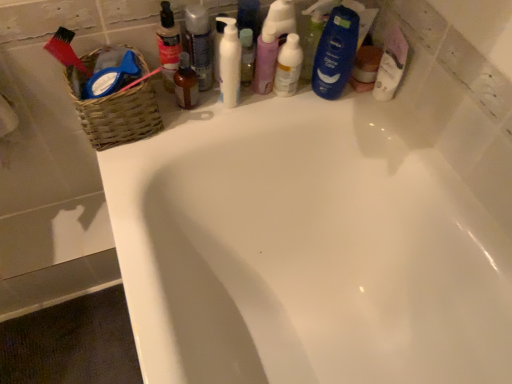
At what (x,y) coordinates should I click in order to perform the action: click on woven brown basket at upper left. Please return your answer as a coordinate pair (x, y). Looking at the image, I should click on (116, 113).

The height and width of the screenshot is (384, 512). Describe the element at coordinates (266, 59) in the screenshot. I see `purple matte lotion at center, which is the 4th toiletry in left-to-right order` at that location.

The image size is (512, 384). Identify the location of white glossy bottle at upper center. (288, 67).

This screenshot has width=512, height=384. What do you see at coordinates (335, 53) in the screenshot? I see `blue glossy shampoo bottle at upper right, the 1th toiletry viewed from the right` at bounding box center [335, 53].

The height and width of the screenshot is (384, 512). What are the coordinates of `translucent plastic bottle at upper center, which is the 1th toiletry in left-to-right order` in the screenshot? It's located at (168, 45).

This screenshot has width=512, height=384. I want to click on white glossy bathtub at upper center, so click(306, 249).

You are a GUI agent. You are given a task and a screenshot of the screen. Output one action in this format:
    pyautogui.click(x=<x>, y=<y>)
    Task: Click on the woven brown basket at upper left
    The height and width of the screenshot is (384, 512).
    Given the screenshot: What is the action you would take?
    pyautogui.click(x=116, y=113)

Does point (88, 116) appear closer or farther from the camera than point (199, 28)?

Point (88, 116) is positioned closer to the camera compared to point (199, 28).

Does woven brown basket at upper left contain translucent plastic bottle at upper center, positioned as the 3th toiletry in right-to-left order?

Definitely not — translucent plastic bottle at upper center, positioned as the 3th toiletry in right-to-left order, is not inside woven brown basket at upper left.

Could you tell me if woven brown basket at upper left is turned towards translucent plastic bottle at upper center, positioned as the 3th toiletry in right-to-left order?

No, woven brown basket at upper left is not facing towards translucent plastic bottle at upper center, positioned as the 3th toiletry in right-to-left order.

Is woven brown basket at upper left closer to camera compared to translucent plastic bottle at upper center, positioned as the 3th toiletry in left-to-right order?

Yes.

Is white matte pump bottle at upper center looking in the opposite direction of white glossy bathtub at upper center?

That's not correct — white matte pump bottle at upper center is not looking away from white glossy bathtub at upper center.

Is white matte pump bottle at upper center closer to the viewer compared to white glossy bathtub at upper center?

No.

From the image's perspective, which is above, white matte pump bottle at upper center or white glossy bathtub at upper center?

From the image's view, white matte pump bottle at upper center is above.

The width and height of the screenshot is (512, 384). I want to click on bathtub on the right of white matte pump bottle at upper center, so click(x=306, y=249).

From the picture: Is blue glossy shampoo bottle at upper right, which ranks as the fifth toiletry in left-to-right order, facing towards translucent plastic bottle at upper center, the 5th toiletry in the right-to-left sequence?

No, blue glossy shampoo bottle at upper right, which ranks as the fifth toiletry in left-to-right order, is not facing towards translucent plastic bottle at upper center, the 5th toiletry in the right-to-left sequence.

From the image's perspective, is blue glossy shampoo bottle at upper right, the 1th toiletry viewed from the right, on top of translucent plastic bottle at upper center, the 5th toiletry in the right-to-left sequence?

Correct, blue glossy shampoo bottle at upper right, the 1th toiletry viewed from the right, appears higher than translucent plastic bottle at upper center, the 5th toiletry in the right-to-left sequence, in the image.

Based on their positions, is blue glossy shampoo bottle at upper right, which ranks as the fifth toiletry in left-to-right order, located to the left or right of translucent plastic bottle at upper center, the 5th toiletry in the right-to-left sequence?

blue glossy shampoo bottle at upper right, which ranks as the fifth toiletry in left-to-right order, is to the right of translucent plastic bottle at upper center, the 5th toiletry in the right-to-left sequence.

Can you tell me how much blue glossy shampoo bottle at upper right, which ranks as the fifth toiletry in left-to-right order, and translucent plastic bottle at upper center, which is the 1th toiletry in left-to-right order, differ in facing direction?

60.2 degrees.

In terms of height, does white matte pump bottle at upper center look taller or shorter compared to translucent plastic bottle at upper center, positioned as the 3th toiletry in left-to-right order?

Considering their sizes, white matte pump bottle at upper center has more height than translucent plastic bottle at upper center, positioned as the 3th toiletry in left-to-right order.

From the picture: Between white matte pump bottle at upper center and translucent plastic bottle at upper center, positioned as the 3th toiletry in right-to-left order, which one is positioned behind?

translucent plastic bottle at upper center, positioned as the 3th toiletry in right-to-left order, is behind.

From the image's perspective, would you say white matte pump bottle at upper center is positioned over translucent plastic bottle at upper center, positioned as the 3th toiletry in right-to-left order?

No, from the image's perspective, white matte pump bottle at upper center is not over translucent plastic bottle at upper center, positioned as the 3th toiletry in right-to-left order.

Is point (222, 57) more distant than point (206, 90)?

No, (222, 57) is closer to viewer.

Is point (204, 72) closer or farther from the camera than point (178, 37)?

Point (204, 72) appears to be farther away from the viewer than point (178, 37).

Considering the sizes of translucent plastic bottle at upper center, positioned as the 3th toiletry in right-to-left order, and translucent plastic bottle at upper center, the 5th toiletry in the right-to-left sequence, in the image, is translucent plastic bottle at upper center, positioned as the 3th toiletry in right-to-left order, taller or shorter than translucent plastic bottle at upper center, the 5th toiletry in the right-to-left sequence,?

Considering their sizes, translucent plastic bottle at upper center, positioned as the 3th toiletry in right-to-left order, has less height than translucent plastic bottle at upper center, the 5th toiletry in the right-to-left sequence.

Looking at their sizes, would you say translucent plastic bottle at upper center, positioned as the 3th toiletry in right-to-left order, is wider or thinner than translucent plastic bottle at upper center, which is the 1th toiletry in left-to-right order?

In the image, translucent plastic bottle at upper center, positioned as the 3th toiletry in right-to-left order, appears to be wider than translucent plastic bottle at upper center, which is the 1th toiletry in left-to-right order.

How far apart are blue glossy shampoo bottle at upper right, the 1th toiletry viewed from the right, and woven brown basket at upper left?

blue glossy shampoo bottle at upper right, the 1th toiletry viewed from the right, and woven brown basket at upper left are 17.18 inches apart from each other.

Which point is more distant from viewer, (325, 59) or (108, 108)?

Point (325, 59)

Does blue glossy shampoo bottle at upper right, the 1th toiletry viewed from the right, have a greater width compared to woven brown basket at upper left?

Incorrect, the width of blue glossy shampoo bottle at upper right, the 1th toiletry viewed from the right, does not surpass that of woven brown basket at upper left.

Is blue glossy shampoo bottle at upper right, the 1th toiletry viewed from the right, facing away from woven brown basket at upper left?

No, blue glossy shampoo bottle at upper right, the 1th toiletry viewed from the right, is not facing away from woven brown basket at upper left.

How distant is brown glass bottle at upper center, the second toiletry from the left, from white glossy bottle at upper center?

brown glass bottle at upper center, the second toiletry from the left, is 8.20 inches away from white glossy bottle at upper center.

Is brown glass bottle at upper center, the second toiletry from the left, thinner than white glossy bottle at upper center?

Yes.

There is a brown glass bottle at upper center, which is the fourth toiletry in right-to-left order. What are the coordinates of `mouthwash above it (from a real-world perspective)` in the screenshot? It's located at (288, 67).

Is brown glass bottle at upper center, which is the fourth toiletry in right-to-left order, not close to white glossy bottle at upper center?

That's not correct — brown glass bottle at upper center, which is the fourth toiletry in right-to-left order, is a little close to white glossy bottle at upper center.

This screenshot has width=512, height=384. I want to click on the 5th toiletry above when counting from the woven brown basket at upper left (from the image's perspective), so click(199, 44).

In the image, there is a white matte pump bottle at upper center. Where is `bathtub below it (from a real-world perspective)`? The image size is (512, 384). bathtub below it (from a real-world perspective) is located at coordinates (306, 249).

Based on the photo, looking at the image, which one is located further to white matte pump bottle at upper center, white glossy bathtub at upper center or brown glass bottle at upper center, the second toiletry from the left?

Based on the image, white glossy bathtub at upper center appears to be further to white matte pump bottle at upper center.

From the image, which object appears to be farther from translucent plastic bottle at upper center, positioned as the 3th toiletry in left-to-right order, purple matte lotion at center, which is the 4th toiletry in left-to-right order, or brown glass bottle at upper center, which is the fourth toiletry in right-to-left order?

Based on the image, purple matte lotion at center, which is the 4th toiletry in left-to-right order, appears to be further to translucent plastic bottle at upper center, positioned as the 3th toiletry in left-to-right order.

Estimate the real-world distances between objects in this image. Which object is further from purple matte lotion at center, which ranks as the 2th toiletry in right-to-left order, white glossy bottle at upper center or white glossy bathtub at upper center?

Among the two, white glossy bathtub at upper center is located further to purple matte lotion at center, which ranks as the 2th toiletry in right-to-left order.

Consider the image. Based on their spatial positions, is white matte pump bottle at upper center or white glossy bathtub at upper center further from translucent plastic bottle at upper center, which is the 1th toiletry in left-to-right order?

white glossy bathtub at upper center is positioned further to the anchor translucent plastic bottle at upper center, which is the 1th toiletry in left-to-right order.

From the image, which object appears to be farther from brown glass bottle at upper center, which is the fourth toiletry in right-to-left order, white glossy bathtub at upper center or woven brown basket at upper left?

white glossy bathtub at upper center.

Which object lies nearer to the anchor point white matte pump bottle at upper center, translucent plastic bottle at upper center, positioned as the 3th toiletry in left-to-right order, or purple matte lotion at center, which ranks as the 2th toiletry in right-to-left order?

translucent plastic bottle at upper center, positioned as the 3th toiletry in left-to-right order, lies closer to white matte pump bottle at upper center than the other object.

Looking at the image, which one is located closer to woven brown basket at upper left, translucent plastic bottle at upper center, the 5th toiletry in the right-to-left sequence, or white glossy bathtub at upper center?

Among the two, translucent plastic bottle at upper center, the 5th toiletry in the right-to-left sequence, is located nearer to woven brown basket at upper left.

Looking at the image, which one is located closer to brown glass bottle at upper center, the second toiletry from the left, white glossy bathtub at upper center or white glossy bottle at upper center?

The object closer to brown glass bottle at upper center, the second toiletry from the left, is white glossy bottle at upper center.

This screenshot has width=512, height=384. Identify the location of toiletry situated between translucent plastic bottle at upper center, positioned as the 3th toiletry in left-to-right order, and white glossy bottle at upper center from left to right. (266, 59).

Image resolution: width=512 pixels, height=384 pixels. Identify the location of basket between blue glossy shampoo bottle at upper right, the 1th toiletry viewed from the right, and white glossy bathtub at upper center in the up-down direction. (116, 113).

Image resolution: width=512 pixels, height=384 pixels. What are the coordinates of `toiletry that lies between white matte pump bottle at upper center and white glossy bathtub at upper center from top to bottom` in the screenshot? It's located at (186, 83).

Image resolution: width=512 pixels, height=384 pixels. What are the coordinates of `toiletry situated between translucent plastic bottle at upper center, positioned as the 3th toiletry in left-to-right order, and blue glossy shampoo bottle at upper right, which ranks as the fifth toiletry in left-to-right order, from left to right` in the screenshot? It's located at (266, 59).